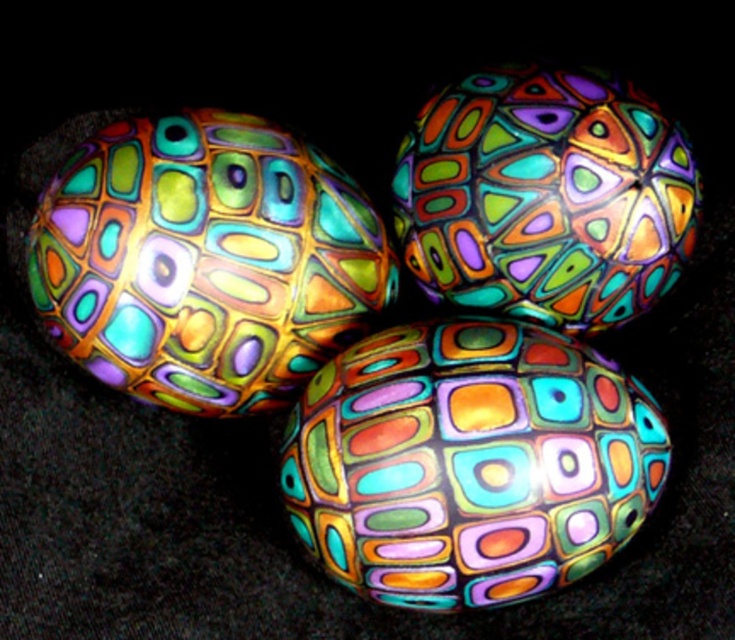
Question: Which of the following is the closest to the observer?

Choices:
 (A) multicolored glass egg at center
 (B) glossy ceramic easter egg at upper center

Answer: (A)

Question: Which point is closer to the camera?

Choices:
 (A) (584, 124)
 (B) (373, 432)
 (C) (32, 292)

Answer: (B)

Question: Which point is closer to the camera taking this photo?

Choices:
 (A) coord(545,342)
 (B) coord(356,308)
 (C) coord(664,285)

Answer: (A)

Question: Can you confirm if glossy ceramic easter egg at center is positioned to the right of glossy ceramic easter egg at upper center?

Choices:
 (A) no
 (B) yes

Answer: (B)

Question: Can you confirm if glossy ceramic easter egg at center is thinner than glossy ceramic easter egg at upper center?

Choices:
 (A) yes
 (B) no

Answer: (B)

Question: Is glossy ceramic easter egg at center thinner than glossy ceramic easter egg at upper center?

Choices:
 (A) yes
 (B) no

Answer: (B)